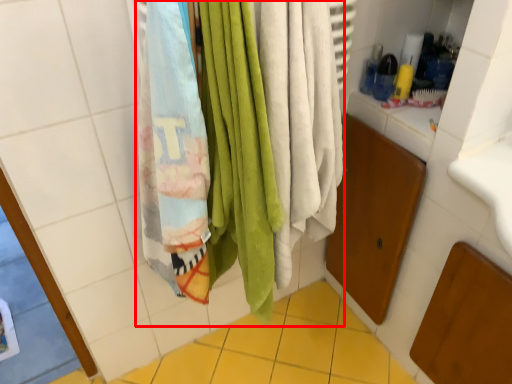
Question: Considering the relative positions of beach towel (annotated by the red box) and ceramic tile in the image provided, where is beach towel (annotated by the red box) located with respect to the staircase?

Choices:
 (A) right
 (B) left

Answer: (A)